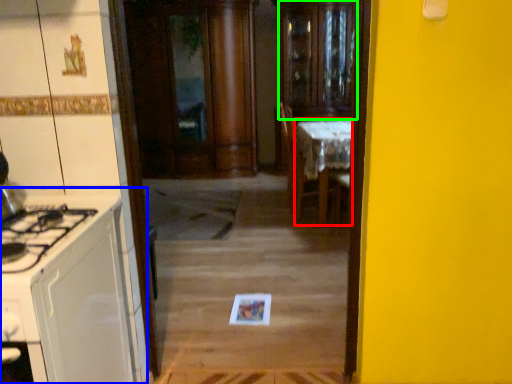
Question: Estimate the real-world distances between objects in this image. Which object is farther from table (highlighted by a red box), cabinetry (highlighted by a blue box) or glass door (highlighted by a green box)?

Choices:
 (A) cabinetry
 (B) glass door

Answer: (A)